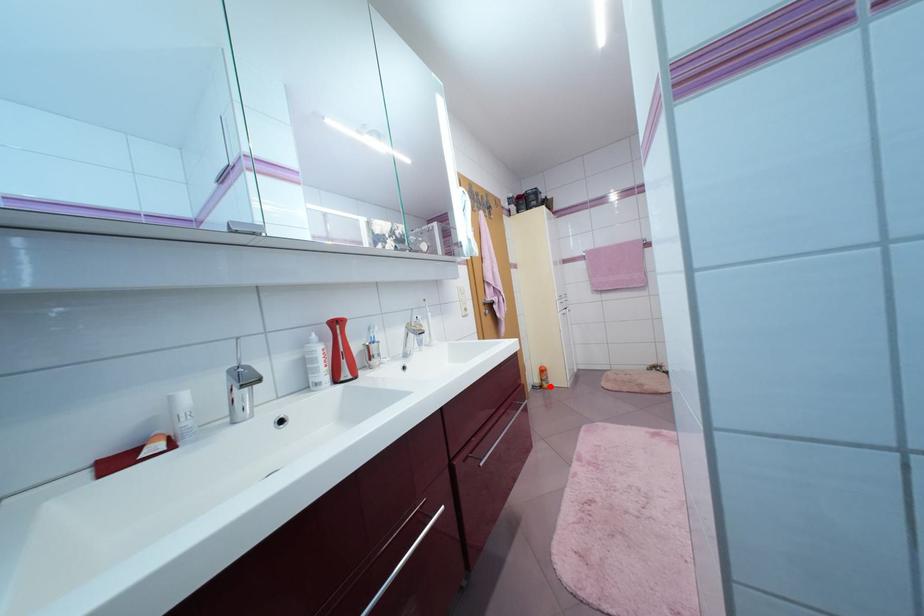
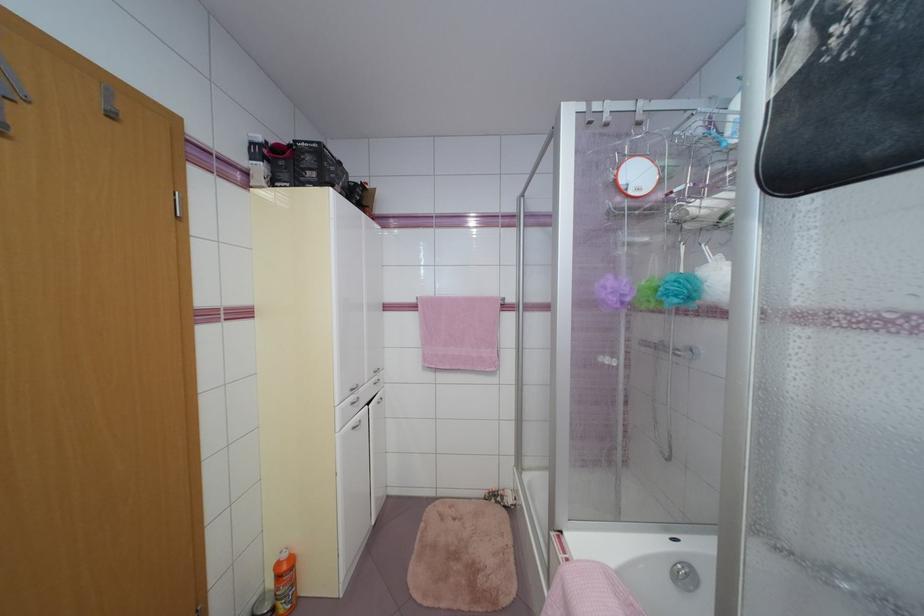
Locate, in the second image, the point that corresponds to the highlighted location in the first image.

(287, 610)